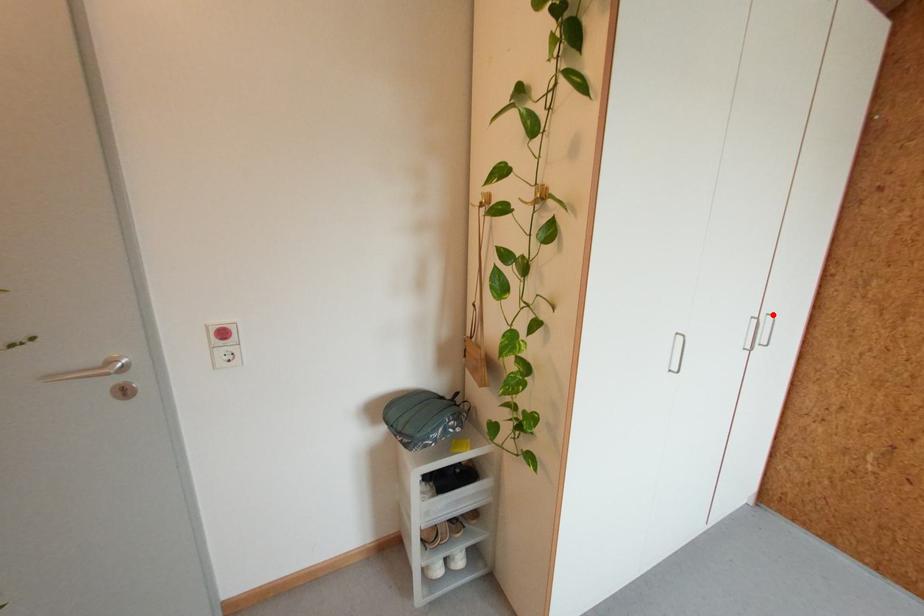
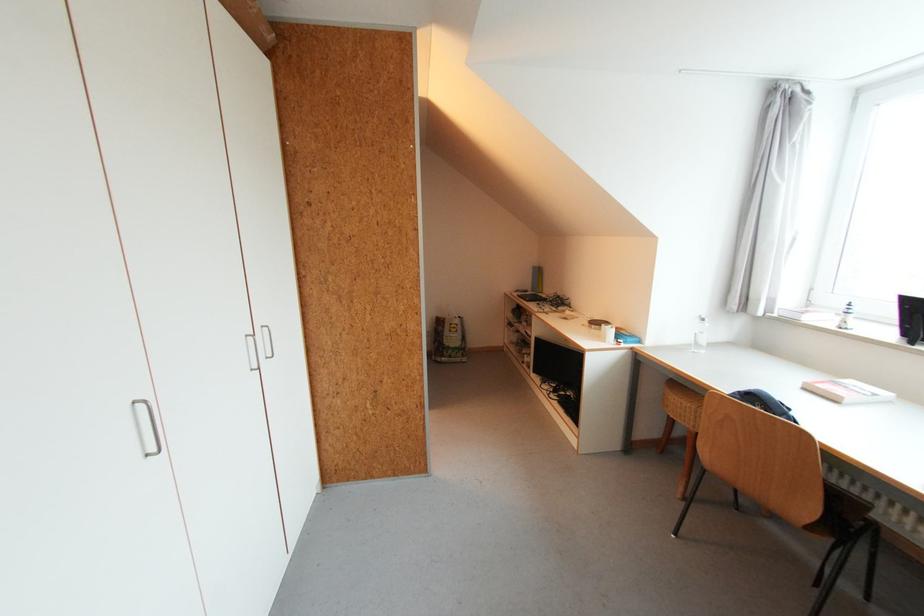
Find the pixel in the second image that matches the highlighted location in the first image.

(268, 326)